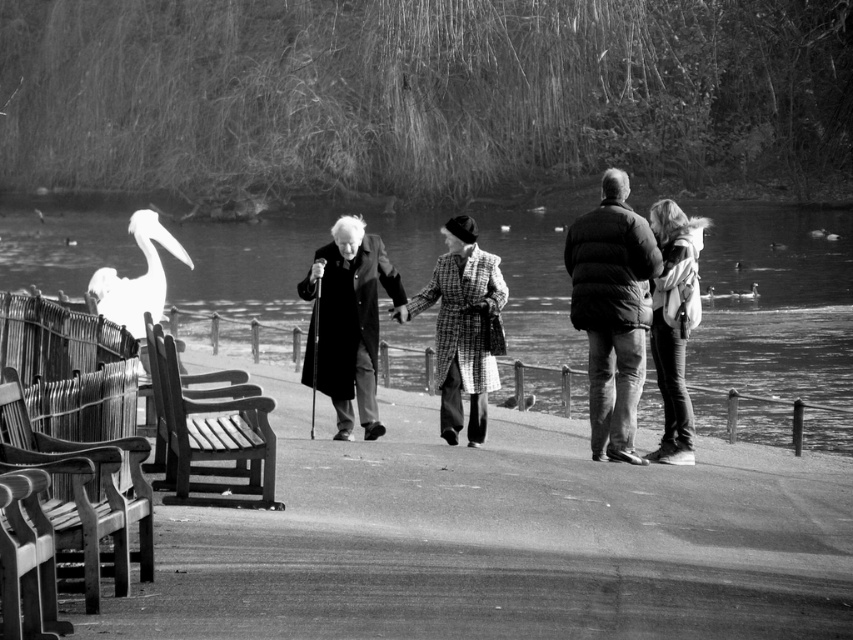
Question: Does black wool coat at center appear on the right side of checkered wool coat at center?

Choices:
 (A) yes
 (B) no

Answer: (B)

Question: Among these objects, which one is nearest to the camera?

Choices:
 (A) checkered wool coat at center
 (B) smooth water at center

Answer: (B)

Question: Does wooden park bench at lower left appear over black wool coat at center?

Choices:
 (A) yes
 (B) no

Answer: (B)

Question: Which point is farther to the camera?

Choices:
 (A) matte black jacket at center
 (B) checkered wool coat at center

Answer: (B)

Question: Which object is closer to the camera taking this photo?

Choices:
 (A) denim jacket at right
 (B) matte black jacket at center

Answer: (B)

Question: Is smooth water at center bigger than matte black jacket at center?

Choices:
 (A) yes
 (B) no

Answer: (A)